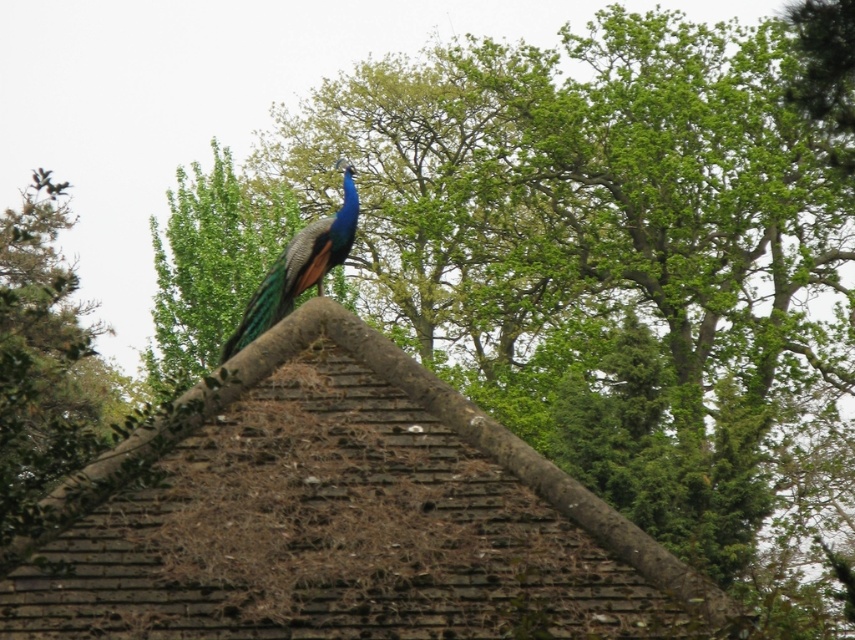
You are a birdwatcher trying to capture a clear photo of the shiny blue peacock at center. The brown textured roof at upper center is in the background. Do you think the roof might be wider than the peacock in the image?

The brown textured roof at upper center might be wider than the shiny blue peacock at center according to the description, so there is a possibility that the roof appears wider in the image.

You are a photographer standing at the camera position aiming to capture the brown textured roof at upper center. If your camera has a focal length of 50mm, will the roof fill the frame adequately? The minimum required distance for a 50mm lens to fill the frame with an object of this size is 50 feet.

The brown textured roof at upper center and camera are 48.11 feet apart, which is less than the 50 feet minimum required distance. Therefore, the roof will fill the frame adequately with a 50mm lens.